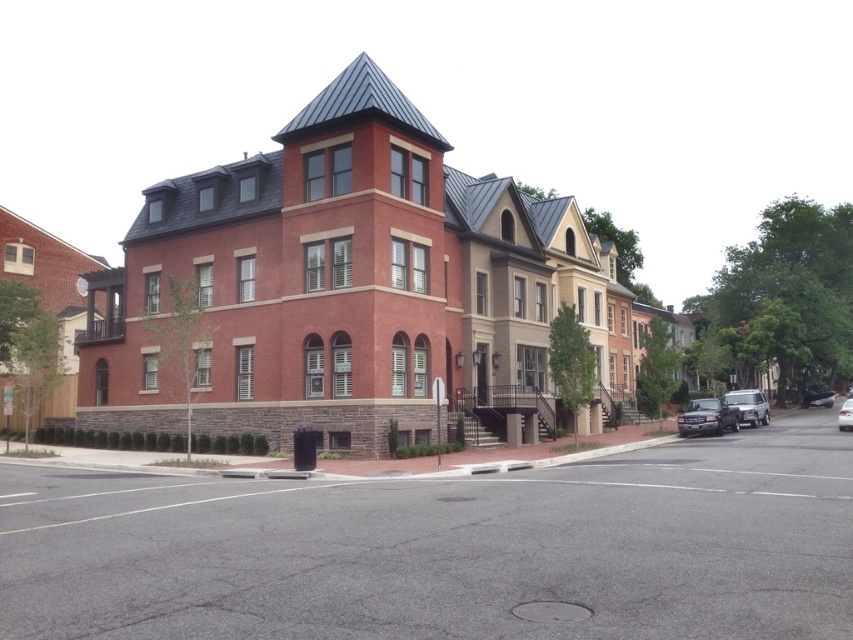
Question: Can you confirm if satin silver sedan at lower right is positioned above white glossy sedan at center?

Choices:
 (A) no
 (B) yes

Answer: (A)

Question: Among these points, which one is farthest from the camera?

Choices:
 (A) (717, 426)
 (B) (851, 426)
 (C) (749, 412)
 (D) (816, 394)

Answer: (D)

Question: Does satin silver sedan at lower right appear on the left side of metallic silver suv at right?

Choices:
 (A) no
 (B) yes

Answer: (B)

Question: Is satin silver sedan at lower right closer to the viewer compared to white glossy sedan at center?

Choices:
 (A) yes
 (B) no

Answer: (A)

Question: Which point is closer to the camera?

Choices:
 (A) metallic silver car at right
 (B) white glossy sedan at center
 (C) metallic silver suv at right
 (D) satin silver sedan at lower right

Answer: (D)

Question: Which point appears farthest from the camera in this image?

Choices:
 (A) (762, 394)
 (B) (712, 401)

Answer: (A)